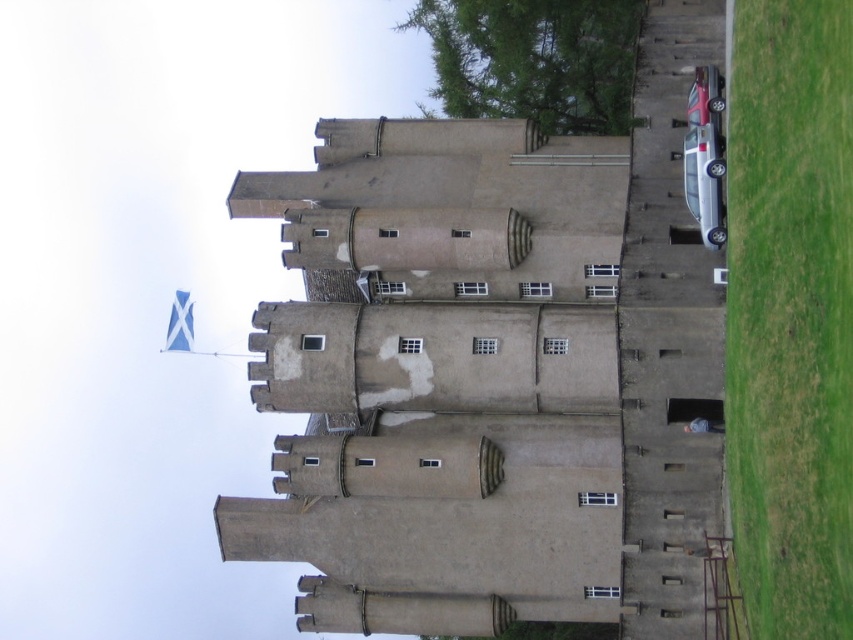
Which is more to the right, green grass at lower right or silver metallic car at right?

From the viewer's perspective, green grass at lower right appears more on the right side.

Is green grass at lower right shorter than silver metallic car at right?

In fact, green grass at lower right may be taller than silver metallic car at right.

Between point (837, 321) and point (701, 152), which one is positioned behind?

Point (701, 152)

Where is `green grass at lower right`? green grass at lower right is located at coordinates (790, 314).

Who is positioned more to the right, green grass at lower right or metallic red car at upper right?

metallic red car at upper right is more to the right.

Is green grass at lower right behind metallic red car at upper right?

That is False.

Between point (770, 157) and point (693, 116), which one is positioned in front?

Point (770, 157)

Find the location of a particular element. green grass at lower right is located at coordinates (790, 314).

Between silver metallic car at right and metallic red car at upper right, which one appears on the left side from the viewer's perspective?

Positioned to the left is silver metallic car at right.

Between silver metallic car at right and metallic red car at upper right, which one has less height?

With less height is silver metallic car at right.

The width and height of the screenshot is (853, 640). What are the coordinates of `silver metallic car at right` in the screenshot? It's located at (704, 180).